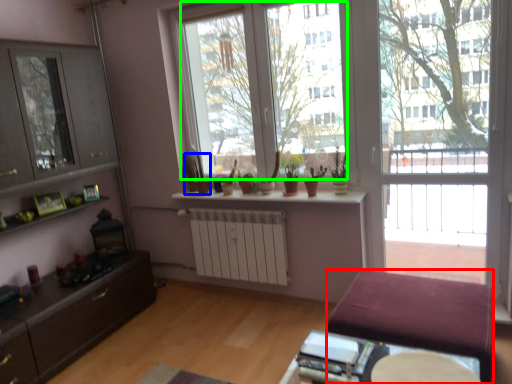
Question: Which object is positioned closest to studio couch (highlighted by a red box)? Select from houseplant (highlighted by a blue box) and window screen (highlighted by a green box).

Choices:
 (A) houseplant
 (B) window screen

Answer: (B)